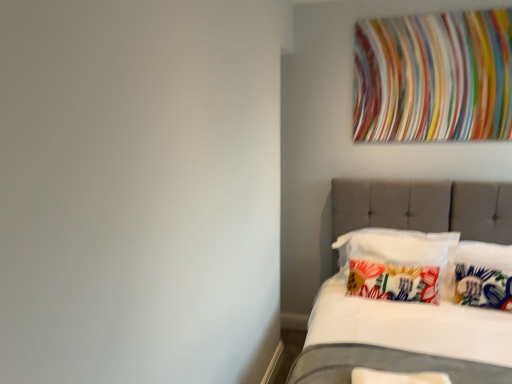
Question: From the image's perspective, does tufted fabric bed at right appear higher than printed fabric pillow at center, positioned as the first pillow in back-to-front order?

Choices:
 (A) no
 (B) yes

Answer: (A)

Question: Considering the relative sizes of tufted fabric bed at right and printed fabric pillow at center, positioned as the first pillow in back-to-front order, in the image provided, is tufted fabric bed at right bigger than printed fabric pillow at center, positioned as the first pillow in back-to-front order,?

Choices:
 (A) no
 (B) yes

Answer: (B)

Question: Is printed fabric pillow at center, positioned as the first pillow in back-to-front order, inside tufted fabric bed at right?

Choices:
 (A) yes
 (B) no

Answer: (A)

Question: Does tufted fabric bed at right come in front of printed fabric pillow at center, positioned as the first pillow in back-to-front order?

Choices:
 (A) yes
 (B) no

Answer: (A)

Question: Is tufted fabric bed at right not inside printed fabric pillow at center, positioned as the 4th pillow in front-to-back order?

Choices:
 (A) yes
 (B) no

Answer: (A)

Question: In terms of height, does multicolored fabric at upper right look taller or shorter compared to floral fabric pillow at center, which is counted as the second pillow, starting from the back?

Choices:
 (A) tall
 (B) short

Answer: (A)

Question: Does point (372, 34) appear closer or farther from the camera than point (375, 266)?

Choices:
 (A) farther
 (B) closer

Answer: (A)

Question: Based on their positions, is multicolored fabric at upper right located to the left or right of floral fabric pillow at center, arranged as the third pillow when viewed from the front?

Choices:
 (A) left
 (B) right

Answer: (B)

Question: Choose the correct answer: Is multicolored fabric at upper right inside floral fabric pillow at center, arranged as the third pillow when viewed from the front, or outside it?

Choices:
 (A) outside
 (B) inside

Answer: (A)

Question: Based on their sizes in the image, would you say white soft pillow at lower right, the 4th pillow in the back-to-front sequence, is bigger or smaller than floral fabric pillow at center, which is counted as the second pillow, starting from the back?

Choices:
 (A) big
 (B) small

Answer: (B)

Question: Does point (376, 375) appear closer or farther from the camera than point (394, 269)?

Choices:
 (A) farther
 (B) closer

Answer: (B)

Question: From the image's perspective, is white soft pillow at lower right, the 4th pillow in the back-to-front sequence, above or below floral fabric pillow at center, which is counted as the second pillow, starting from the back?

Choices:
 (A) above
 (B) below

Answer: (B)

Question: Is white soft pillow at lower right, the 4th pillow in the back-to-front sequence, in front of or behind floral fabric pillow at center, which is counted as the second pillow, starting from the back, in the image?

Choices:
 (A) front
 (B) behind

Answer: (A)

Question: In terms of height, does white soft pillow at lower right, the 4th pillow in the back-to-front sequence, look taller or shorter compared to printed fabric pillow at center, positioned as the 4th pillow in front-to-back order?

Choices:
 (A) short
 (B) tall

Answer: (A)

Question: Does point (410, 380) appear closer or farther from the camera than point (412, 288)?

Choices:
 (A) farther
 (B) closer

Answer: (B)